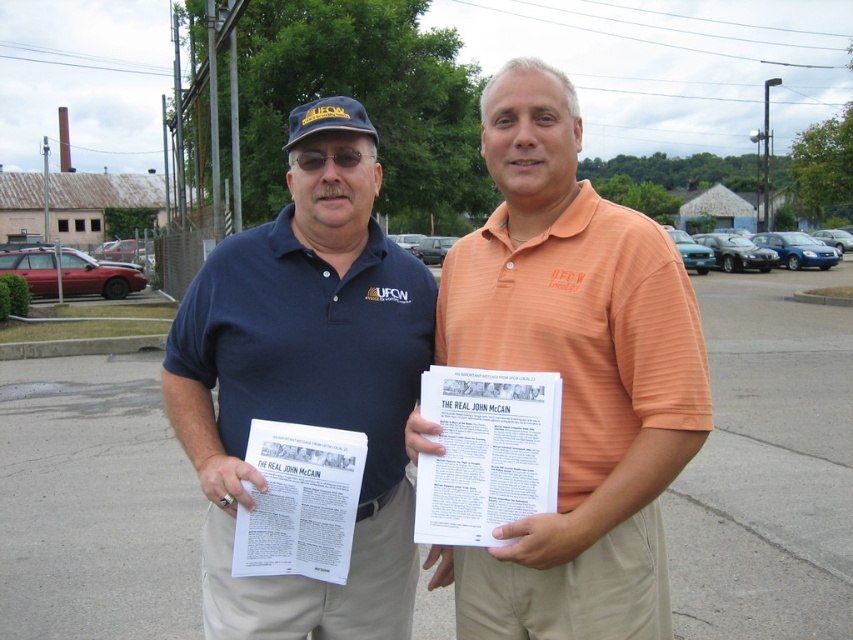
You are a delivery person who needs to deliver a package to the orange striped polo shirt at center. The delivery requires you to walk straight from the point where you are standing at point (572, 376). Is there any obstruction in your path?

The orange striped polo shirt at center is located at point (572, 376), so there is no obstruction in your path since you are already at that location.

You are a photographer setting up for a group photo. You need to ensure that the two men in the image, the orange striped polo shirt at center and the matte blue shirt at center, are positioned exactly 1 meter apart. Based on their current distance, do you need to move them closer or farther apart?

The current distance between the orange striped polo shirt at center and the matte blue shirt at center is 36.69 centimeters. To reach the required 1 meter, they need to move farther apart by approximately 63.31 centimeters.